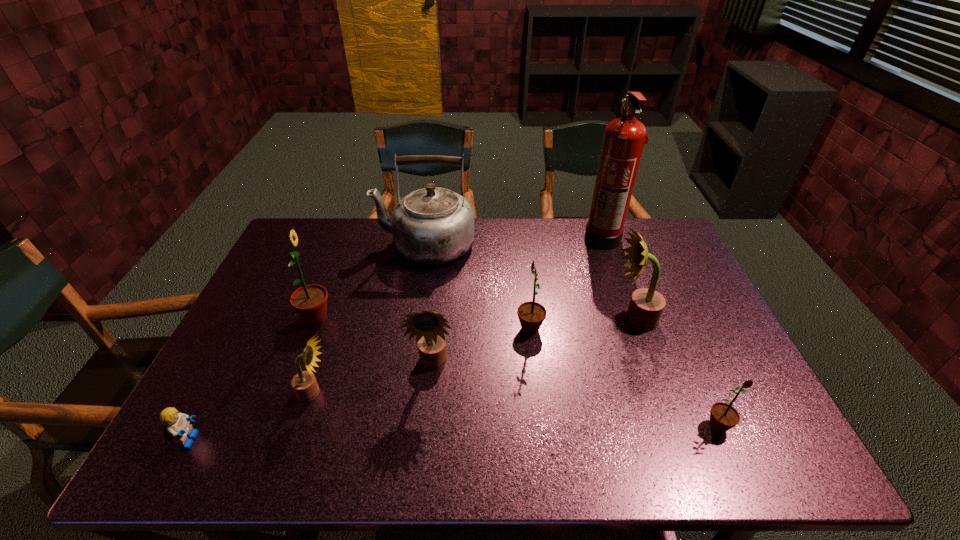
In the image, there is a desktop. Where is `free space at the near edge`? This screenshot has height=540, width=960. free space at the near edge is located at coordinates (345, 437).

Image resolution: width=960 pixels, height=540 pixels. In the image, there is a desktop. Identify the location of vacant space at the left edge. (228, 389).

Image resolution: width=960 pixels, height=540 pixels. I want to click on free space at the right edge, so click(687, 362).

Locate an element on the screen. free spot at the far left corner of the desktop is located at coordinates (319, 249).

I want to click on free space at the near left corner of the desktop, so click(206, 430).

Find the location of `vacant space at the far right corner of the desktop`. vacant space at the far right corner of the desktop is located at coordinates (660, 231).

The image size is (960, 540). I want to click on unoccupied area between the second yellow sunflower from left to right and the second biggest green sunflower, so click(x=482, y=347).

Find the location of `vacant area that lies between the Lego and the nearest green sunflower`. vacant area that lies between the Lego and the nearest green sunflower is located at coordinates (454, 433).

You are a GUI agent. You are given a task and a screenshot of the screen. Output one action in this format:
    pyautogui.click(x=<x>, y=<y>)
    Task: Click on the free space between the third sunflower from left to right and the kettle
    
    Given the screenshot: What is the action you would take?
    pyautogui.click(x=429, y=305)

At what (x,y) coordinates should I click in order to perform the action: click on unoccupied area between the fire extinguisher and the shortest object. Please return your answer as a coordinate pair (x, y). This screenshot has height=540, width=960. Looking at the image, I should click on (396, 339).